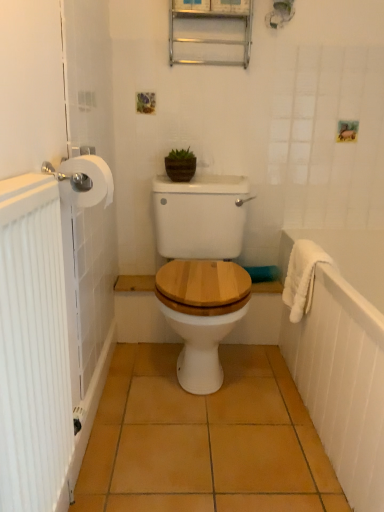
Question: Is white ribbed radiator at left bigger than metallic silver medicine cabinet at upper center?

Choices:
 (A) yes
 (B) no

Answer: (A)

Question: Does white ribbed radiator at left have a greater height compared to metallic silver medicine cabinet at upper center?

Choices:
 (A) yes
 (B) no

Answer: (A)

Question: Can you confirm if white ribbed radiator at left is smaller than metallic silver medicine cabinet at upper center?

Choices:
 (A) no
 (B) yes

Answer: (A)

Question: Does white ribbed radiator at left come behind metallic silver medicine cabinet at upper center?

Choices:
 (A) no
 (B) yes

Answer: (A)

Question: Is white ribbed radiator at left facing towards metallic silver medicine cabinet at upper center?

Choices:
 (A) no
 (B) yes

Answer: (A)

Question: In terms of width, does green matte pot at center look wider or thinner when compared to white matte toilet paper at left?

Choices:
 (A) thin
 (B) wide

Answer: (A)

Question: In terms of height, does green matte pot at center look taller or shorter compared to white matte toilet paper at left?

Choices:
 (A) short
 (B) tall

Answer: (B)

Question: Is green matte pot at center in front of or behind white matte toilet paper at left in the image?

Choices:
 (A) front
 (B) behind

Answer: (B)

Question: Is point (180, 167) positioned closer to the camera than point (69, 168)?

Choices:
 (A) closer
 (B) farther

Answer: (B)

Question: Is metallic silver medicine cabinet at upper center spatially inside white textured towel at right, or outside of it?

Choices:
 (A) outside
 (B) inside

Answer: (A)

Question: From the image's perspective, is metallic silver medicine cabinet at upper center above or below white textured towel at right?

Choices:
 (A) above
 (B) below

Answer: (A)

Question: In the image, is metallic silver medicine cabinet at upper center on the left side or the right side of white textured towel at right?

Choices:
 (A) left
 (B) right

Answer: (A)

Question: Is metallic silver medicine cabinet at upper center taller or shorter than white textured towel at right?

Choices:
 (A) tall
 (B) short

Answer: (B)

Question: In terms of size, does white textured towel at right appear bigger or smaller than white fluffy bath towel at right?

Choices:
 (A) big
 (B) small

Answer: (A)

Question: From their relative heights in the image, would you say white textured towel at right is taller or shorter than white fluffy bath towel at right?

Choices:
 (A) short
 (B) tall

Answer: (B)